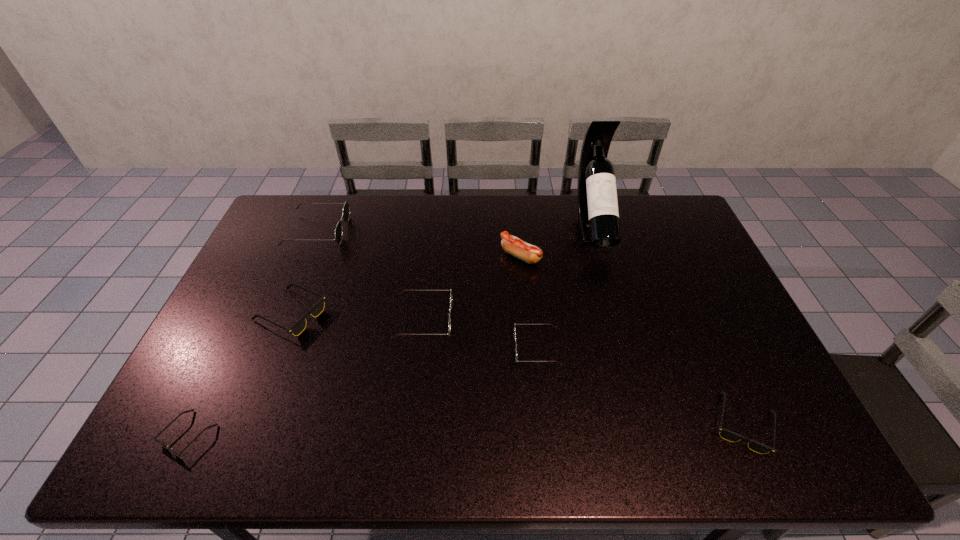
This screenshot has width=960, height=540. I want to click on the rightmost sunglasses, so click(726, 434).

The width and height of the screenshot is (960, 540). Identify the location of the second shortest sunglasses. (726, 434).

I want to click on the shortest sunglasses, so click(x=154, y=438).

What are the coordinates of `the smallest black sunglasses` in the screenshot? It's located at (154, 438).

This screenshot has height=540, width=960. Identify the location of free spot located on the stand of the seventh object from left to right. (614, 301).

Locate an element on the screen. The height and width of the screenshot is (540, 960). free location located on the front-facing side of the leftmost green sunglasses is located at coordinates (446, 231).

The image size is (960, 540). Identify the location of free space located 0.110m on the front of the sausage. (524, 294).

Where is `free space located 0.150m on the front-facing side of the fourth tallest object`? Image resolution: width=960 pixels, height=540 pixels. free space located 0.150m on the front-facing side of the fourth tallest object is located at coordinates (503, 319).

This screenshot has width=960, height=540. Identify the location of vacant space situated 0.160m on the lenses of the biggest black sunglasses. 381,314.

Identify the location of blank space located on the front-facing side of the second sunglasses from right to left. (370, 348).